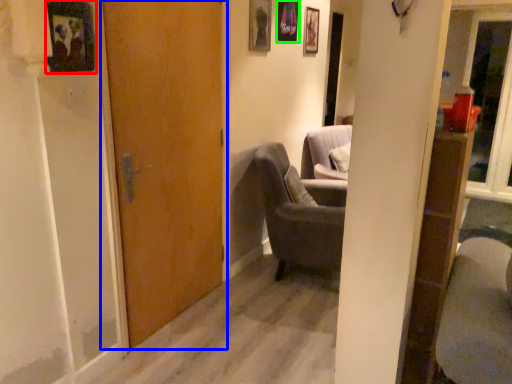
Question: Based on their relative distances, which object is farther from picture frame (highlighted by a red box)? Choose from door (highlighted by a blue box) and picture frame (highlighted by a green box).

Choices:
 (A) door
 (B) picture frame

Answer: (B)